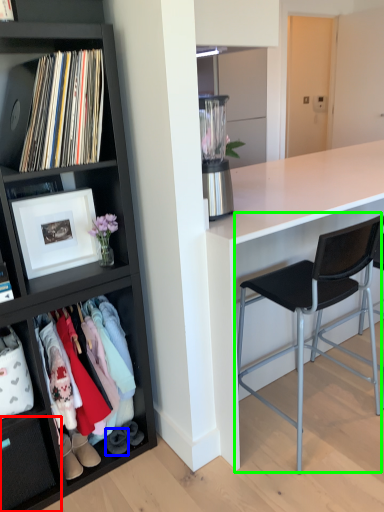
Question: Which object is positioned farthest from drawer (highlighted by a red box)? Select from shoe (highlighted by a blue box) and chair (highlighted by a green box).

Choices:
 (A) shoe
 (B) chair

Answer: (B)